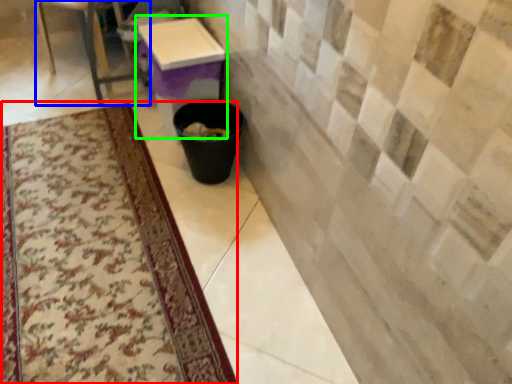
Question: Which object is positioned farthest from mat (highlighted by a red box)? Select from furniture (highlighted by a blue box) and table (highlighted by a green box).

Choices:
 (A) furniture
 (B) table

Answer: (A)